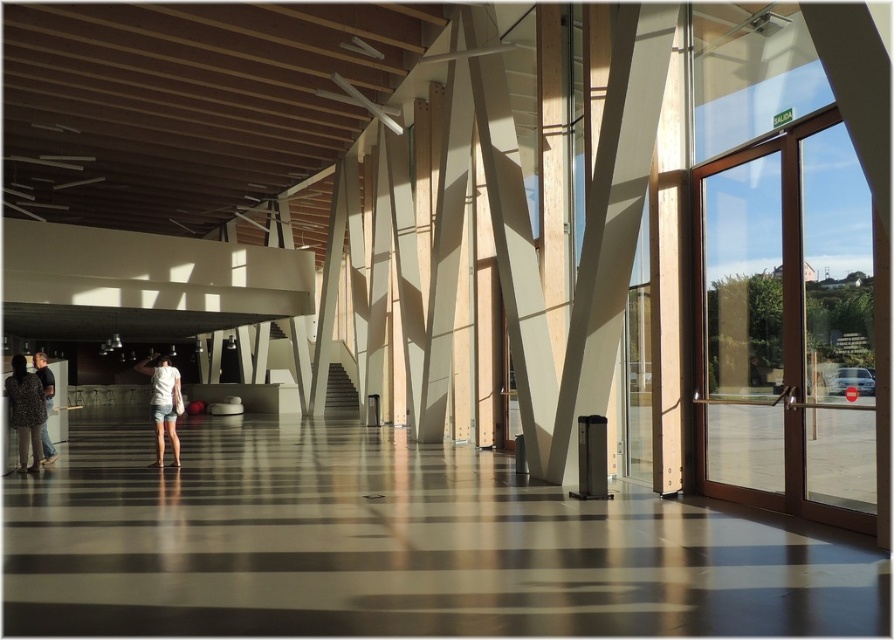
Question: Which object is closer to the camera taking this photo?

Choices:
 (A) patterned fabric dress at lower left
 (B) white cotton shirt at center

Answer: (A)

Question: Does clear glass door at right come behind leather jacket at left?

Choices:
 (A) no
 (B) yes

Answer: (A)

Question: Is clear glass door at right to the right of patterned fabric dress at lower left from the viewer's perspective?

Choices:
 (A) yes
 (B) no

Answer: (A)

Question: Is clear glass door at right to the left of leather jacket at left from the viewer's perspective?

Choices:
 (A) yes
 (B) no

Answer: (B)

Question: Which of the following is the farthest from the observer?

Choices:
 (A) (831, 577)
 (B) (738, 156)
 (C) (49, 456)

Answer: (C)

Question: Which point appears farthest from the camera in this image?

Choices:
 (A) (173, 369)
 (B) (757, 362)

Answer: (A)